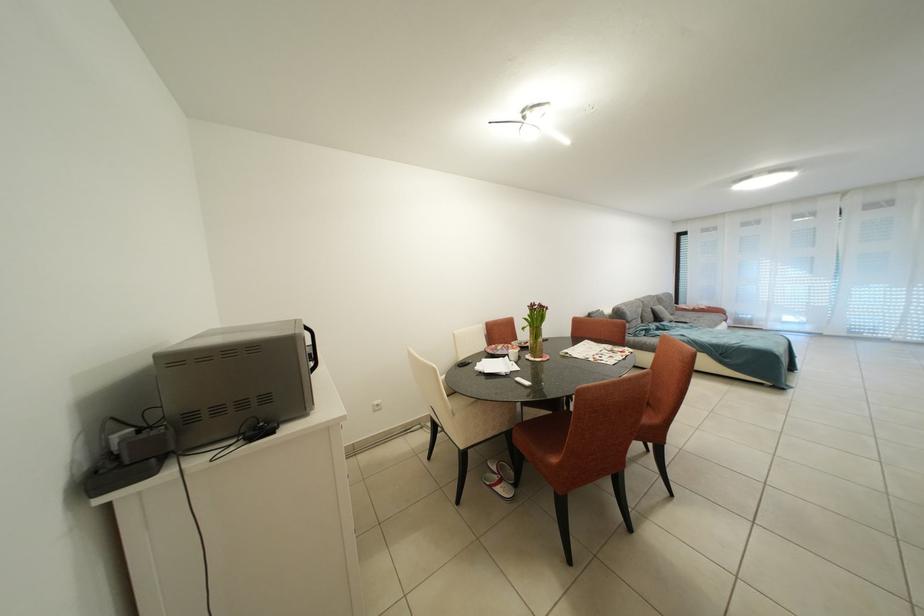
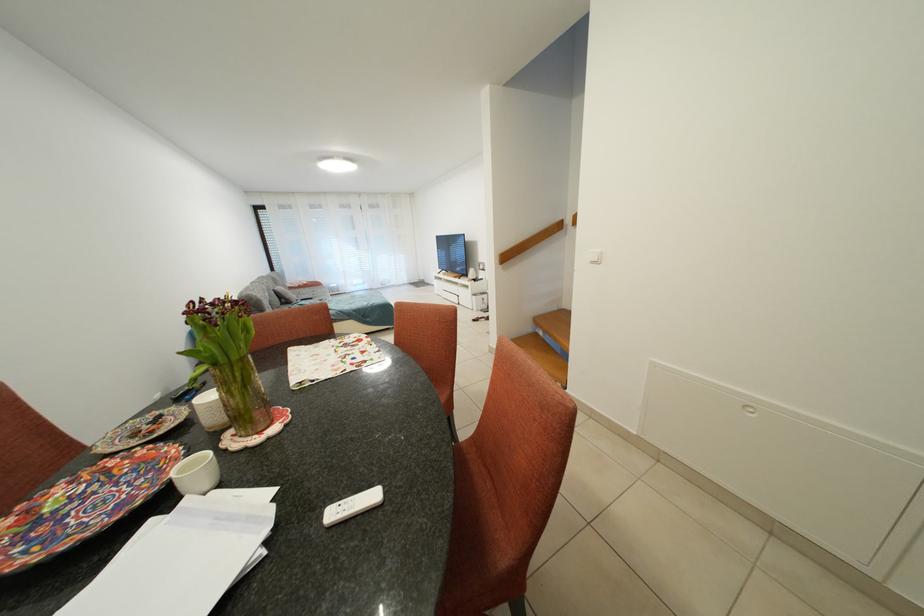
The point at [536,387] is marked in the first image. Where is the corresponding point in the second image?

(382, 501)